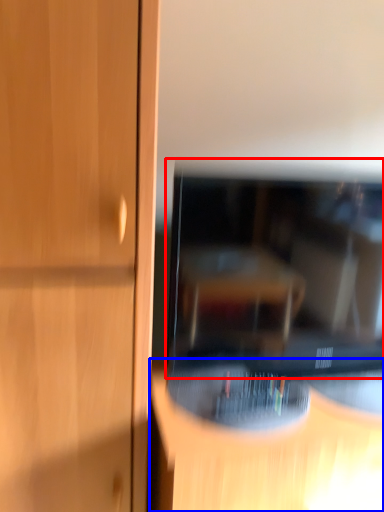
Question: Which point is further to the camera, television (highlighted by a red box) or furniture (highlighted by a blue box)?

Choices:
 (A) television
 (B) furniture

Answer: (A)